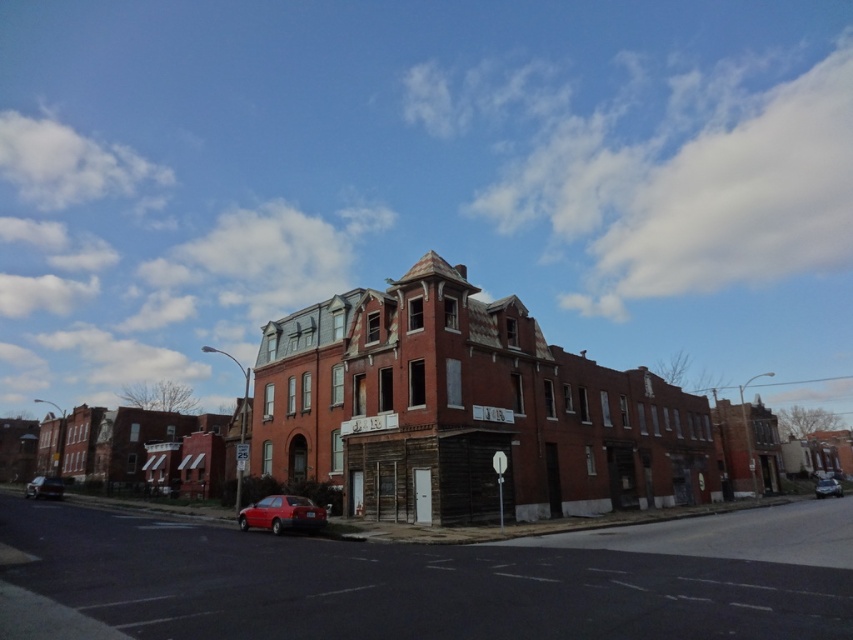
You are a delivery driver who needs to park your vehicle between the shiny red sedan at lower center and the shiny red car at lower left. Given that your vehicle is 4.5 meters long, can you fit it in the space between them?

The shiny red sedan at lower center is smaller than the shiny red car at lower left, but the exact distance between them isn

You are a delivery driver who needs to park your vehicle in this street scene. You have a truck that is 2 meters wide. The shiny red sedan at lower center and metallic silver sedan at lower right are parked. Can you park your truck between them?

The shiny red sedan at lower center is to the left of the metallic silver sedan at lower right. Since the distance between them isn not specified, it is uncertain if there is enough space for a 2 meter wide truck. Check the available space between them before deciding.

You are a delivery driver who needs to park your truck, which is 2 meters wide, between the shiny red sedan at lower center and the metallic silver sedan at lower right. Can you fit your truck there?

The shiny red sedan at lower center has a lesser width compared to metallic silver sedan at lower right, so the distance between them may be sufficient. However, since the exact distance isn